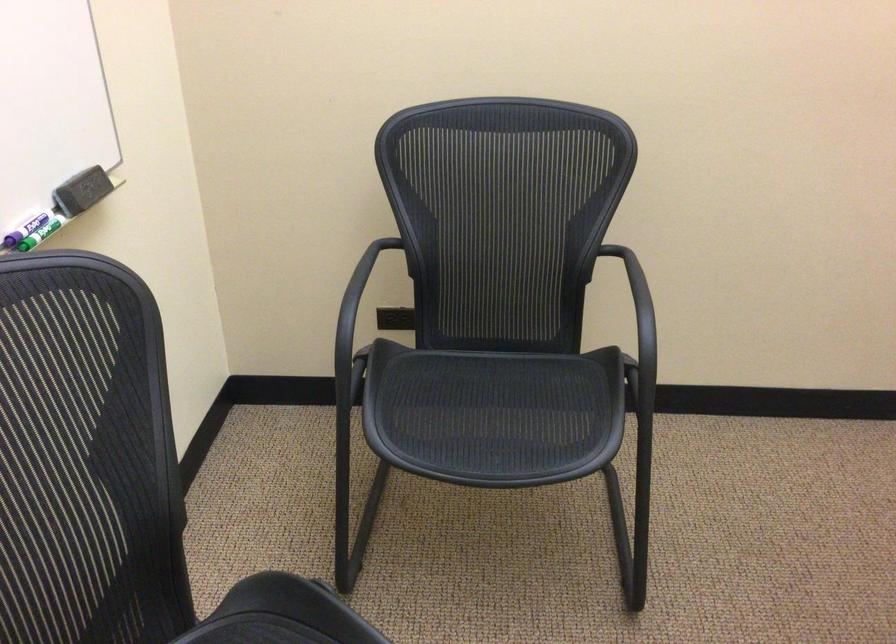
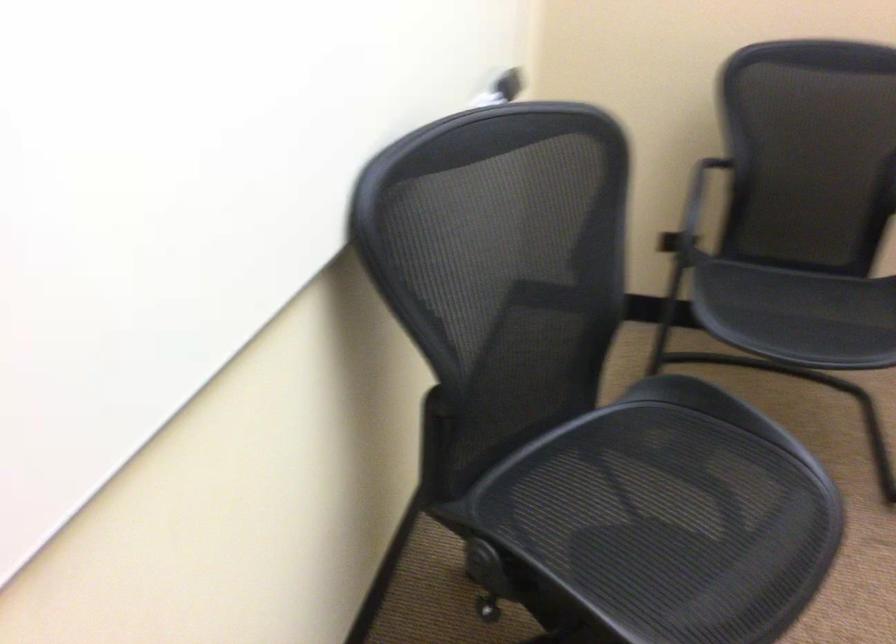
Where in the second image is the point corresponding to point (486, 436) from the first image?

(798, 315)